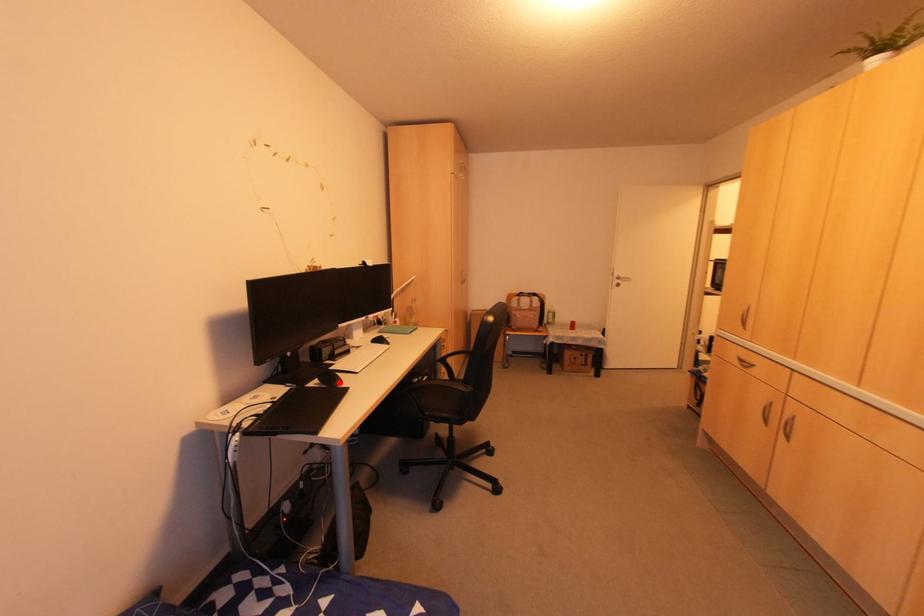
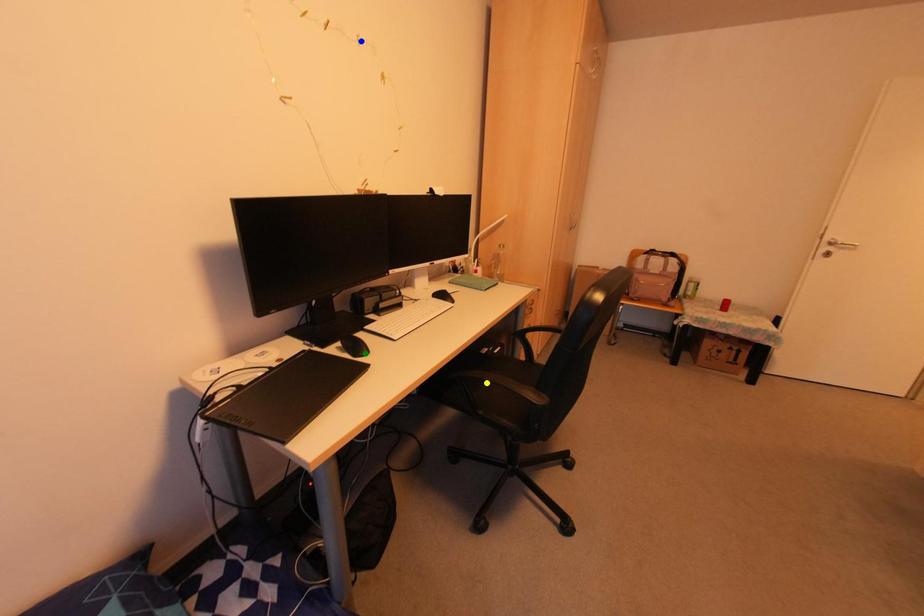
Question: I am providing you with two images of the same scene from different viewpoints. A red point is marked on the first image. You are given multiple points on the second image. Can you choose the point in image 2 that corresponds to the point in image 1?

Choices:
 (A) green point
 (B) blue point
 (C) yellow point

Answer: (A)